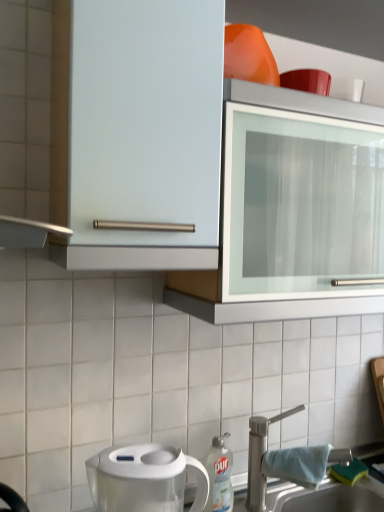
Question: Considering the relative positions of white metallic tap at lower right and white plastic dish soap bottle at lower center in the image provided, is white metallic tap at lower right to the left or to the right of white plastic dish soap bottle at lower center?

Choices:
 (A) left
 (B) right

Answer: (B)

Question: In terms of height, does white metallic tap at lower right look taller or shorter compared to white plastic dish soap bottle at lower center?

Choices:
 (A) short
 (B) tall

Answer: (B)

Question: Which object is the farthest from the white metallic tap at lower right?

Choices:
 (A) white ceramic sink at lower right
 (B) white plastic dish soap bottle at lower center
 (C) transparent plastic water filter pitcher at lower left

Answer: (C)

Question: Which of these objects is positioned closest to the transparent plastic water filter pitcher at lower left?

Choices:
 (A) white plastic dish soap bottle at lower center
 (B) white ceramic sink at lower right
 (C) white metallic tap at lower right

Answer: (A)